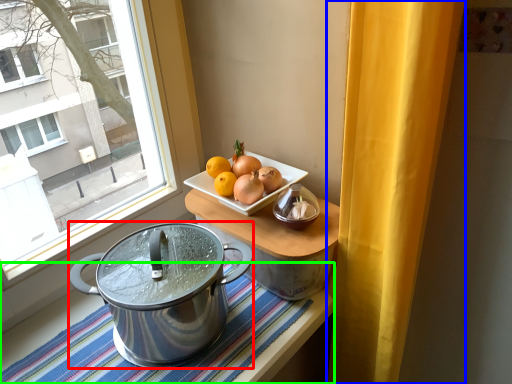
Question: Which object is positioned farthest from kitchen appliance (highlighted by a red box)? Select from curtain (highlighted by a blue box) and tablecloth (highlighted by a green box).

Choices:
 (A) curtain
 (B) tablecloth

Answer: (A)